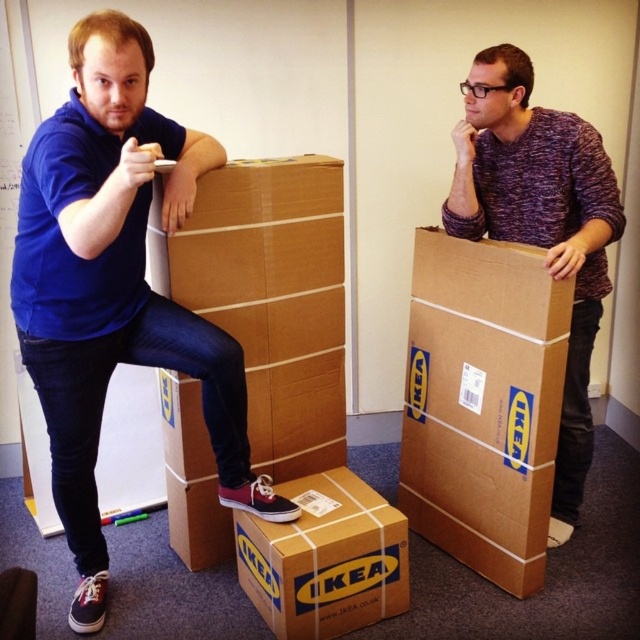
You are organizing a storage room and need to place the brown cardboard box at right and the purple knitted sweater at upper right. Which object should you place first if you want to prioritize placing larger items first?

The purple knitted sweater at upper right should be placed first because it is larger than the brown cardboard box at right.

Consider the image. You are trying to decide whether to place a new poster on the wall behind the matte blue shirt at left and the brown cardboard box at right. Which object should you consider first if you want to place the poster higher up?

The matte blue shirt at left should be considered first because it has a greater height compared to the brown cardboard box at right, so placing the poster higher would need to account for its taller stature.